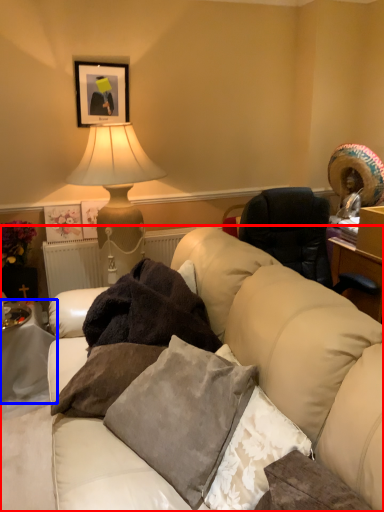
Question: Among these objects, which one is farthest to the camera, studio couch (highlighted by a red box) or table (highlighted by a blue box)?

Choices:
 (A) studio couch
 (B) table

Answer: (B)